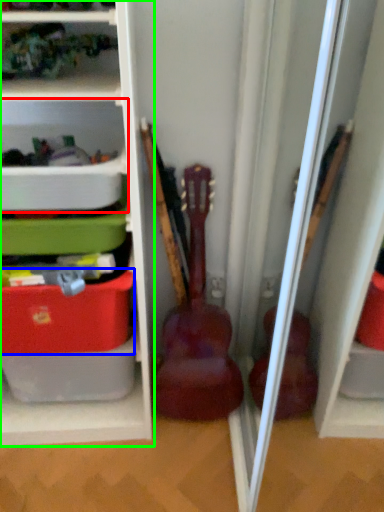
Question: Which object is the closest to the shelf (highlighted by a red box)? Choose among these: storage box (highlighted by a blue box) or shelf (highlighted by a green box).

Choices:
 (A) storage box
 (B) shelf

Answer: (B)